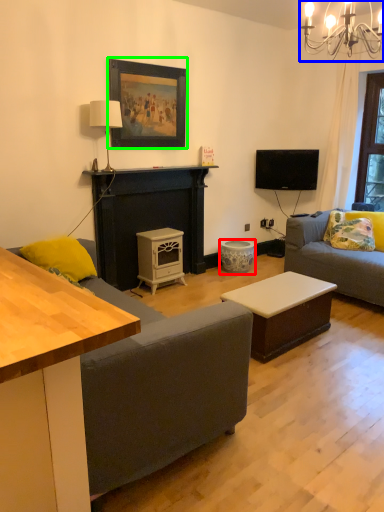
Question: Which object is the closest to the stool (highlighted by a red box)? Choose among these: light fixture (highlighted by a blue box) or picture frame (highlighted by a green box).

Choices:
 (A) light fixture
 (B) picture frame

Answer: (B)